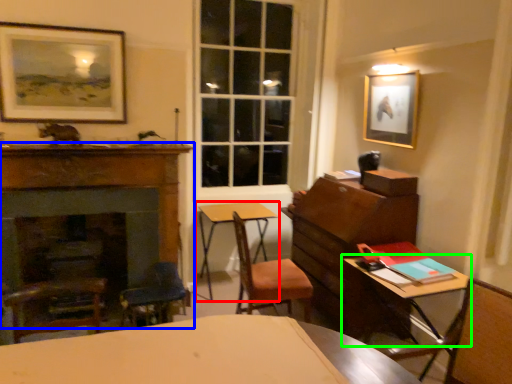
Question: Based on their relative distances, which object is nearer to table (highlighted by a red box)? Choose from fireplace (highlighted by a blue box) and table (highlighted by a green box).

Choices:
 (A) fireplace
 (B) table

Answer: (A)